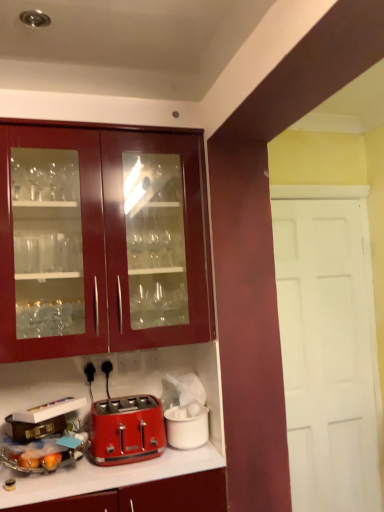
Where is `free spot above white matte ice bucket at lower center, which ranks as the 1th appliance in right-to-left order (from a real-world perspective)`? Image resolution: width=384 pixels, height=512 pixels. free spot above white matte ice bucket at lower center, which ranks as the 1th appliance in right-to-left order (from a real-world perspective) is located at coordinates (179, 411).